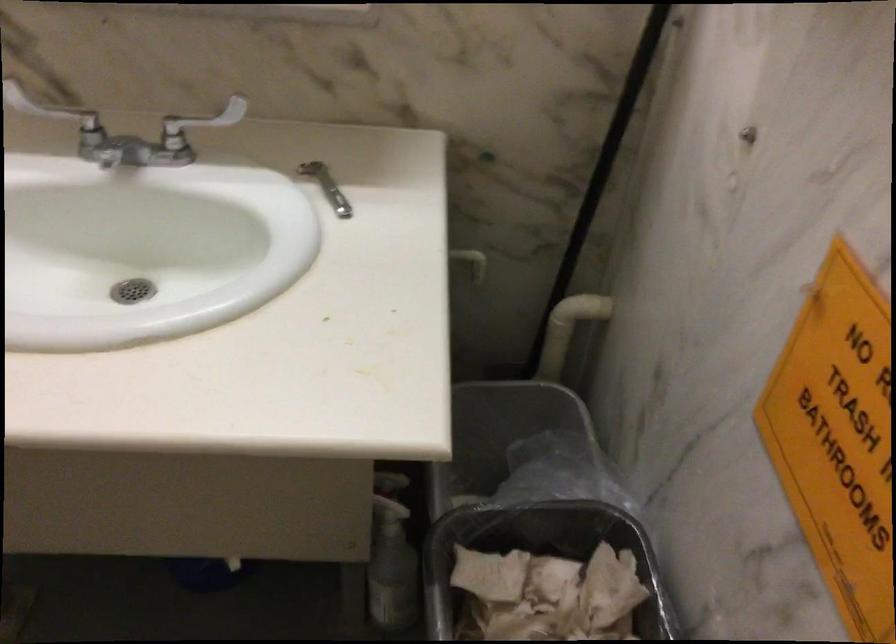
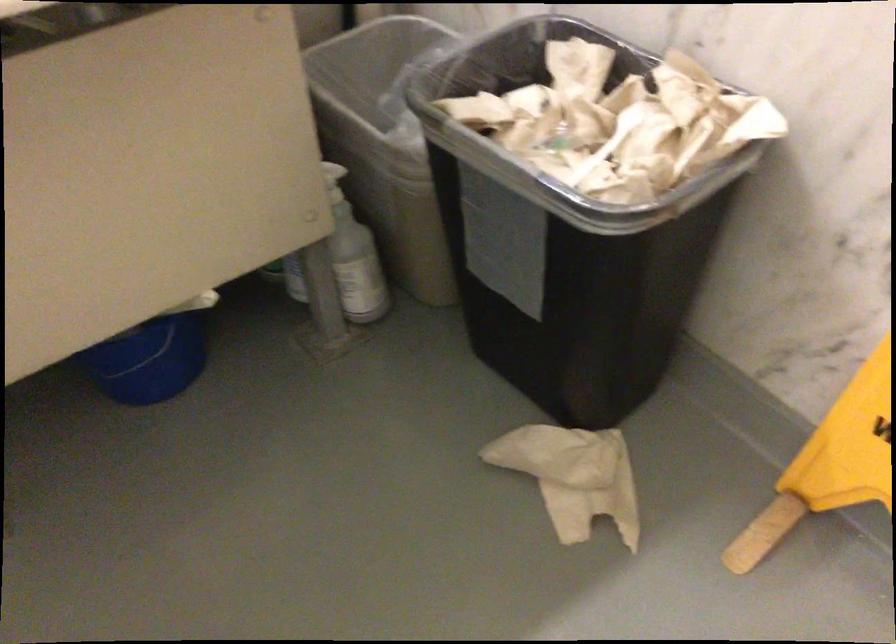
Question: How did the camera likely rotate?

Choices:
 (A) Left
 (B) Right
 (C) Up
 (D) Down

Answer: (B)